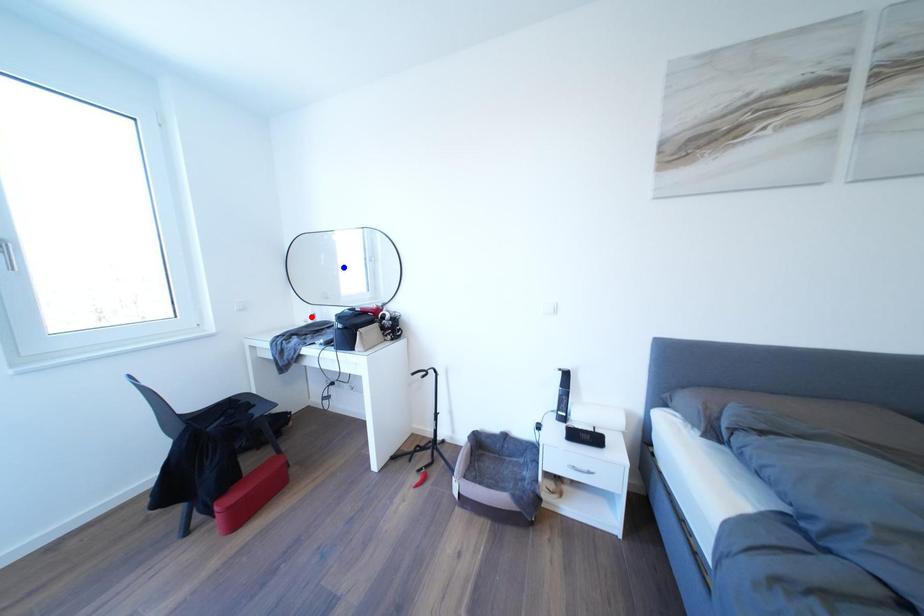
Question: Two points are marked on the image. Which point is closer to the camera?

Choices:
 (A) Blue point is closer.
 (B) Red point is closer.

Answer: (B)